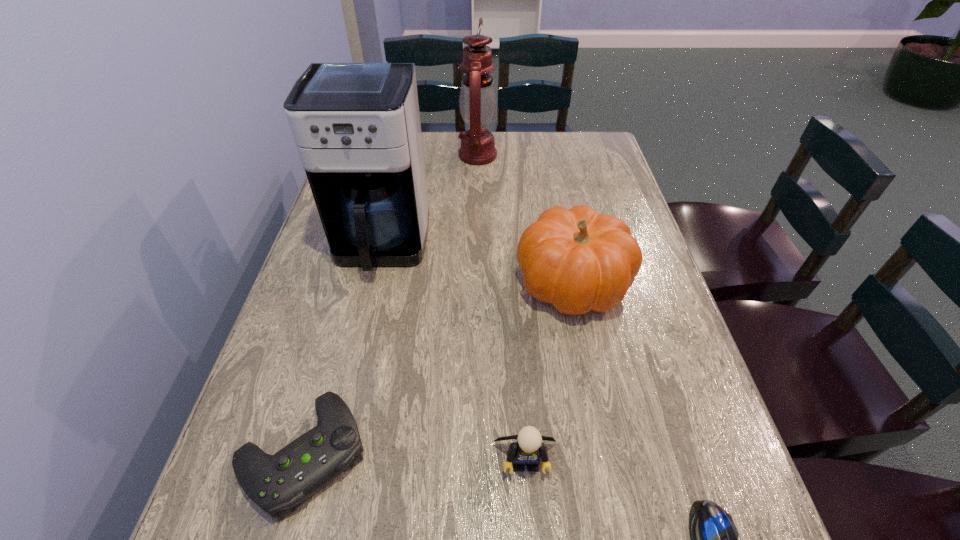
Locate an element on the screen. coffee maker at the left edge is located at coordinates (356, 125).

Image resolution: width=960 pixels, height=540 pixels. In order to click on control located at the left edge in this screenshot , I will do `click(276, 483)`.

I want to click on object situated at the right edge, so click(577, 260).

Locate an element on the screen. The width and height of the screenshot is (960, 540). vacant space at the far edge of the desktop is located at coordinates (525, 148).

This screenshot has height=540, width=960. Identify the location of vacant area at the left edge of the desktop. (323, 377).

Identify the location of free region at the right edge of the desktop. (615, 178).

In the image, there is a desktop. Identify the location of vacant area at the far right corner. The width and height of the screenshot is (960, 540). (609, 167).

The width and height of the screenshot is (960, 540). I want to click on free space that is in between the third shortest object and the oil lamp, so (x=501, y=307).

Locate an element on the screen. This screenshot has height=540, width=960. free space between the pumpkin and the coffee maker is located at coordinates (477, 264).

Where is `free space between the fourth shortest object and the farthest object`? free space between the fourth shortest object and the farthest object is located at coordinates (525, 219).